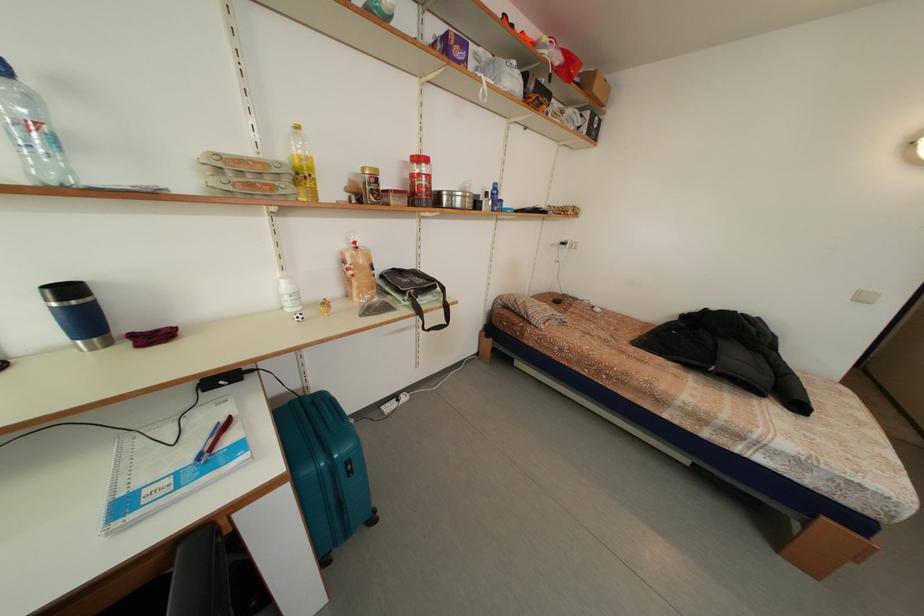
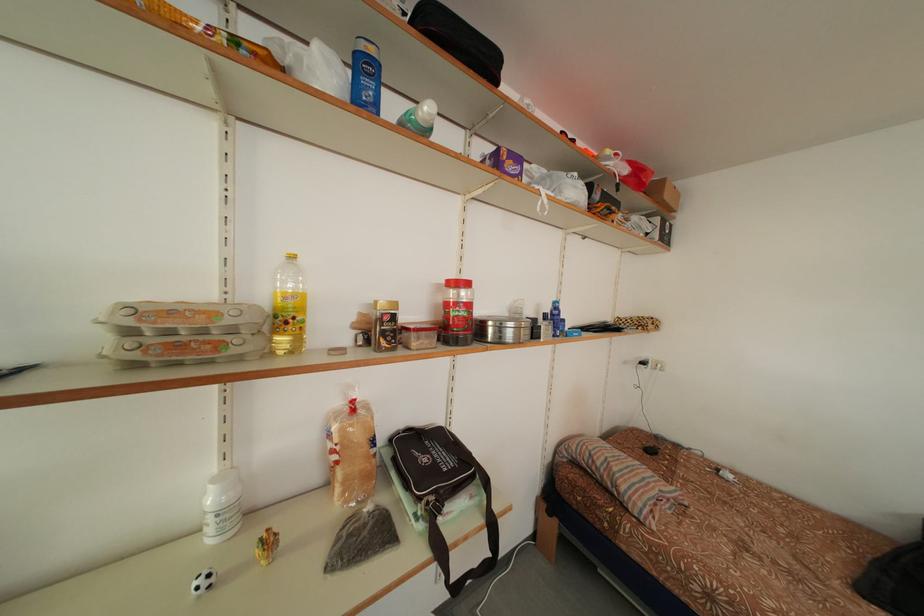
Where in the second image is the point corresponding to [362,248] from the first image?

(360, 407)